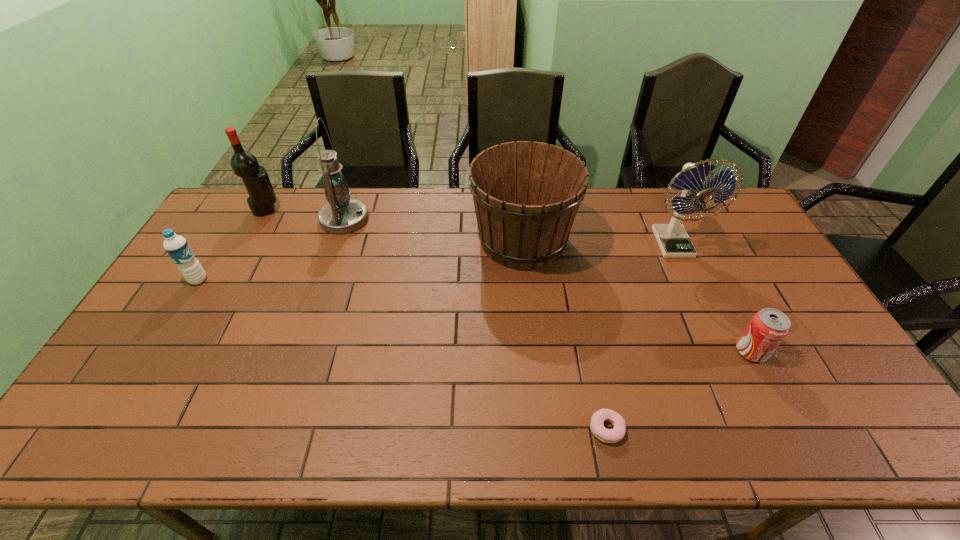
Identify which object is located as the fourth nearest to the second nearest object. Please provide its 2D coordinates. Your answer should be formatted as a tuple, i.e. [(x, y)], where the tuple contains the x and y coordinates of a point satisfying the conditions above.

[(342, 215)]

Locate which object ranks second in proximity to the oil lamp. Please provide its 2D coordinates. Your answer should be formatted as a tuple, i.e. [(x, y)], where the tuple contains the x and y coordinates of a point satisfying the conditions above.

[(176, 246)]